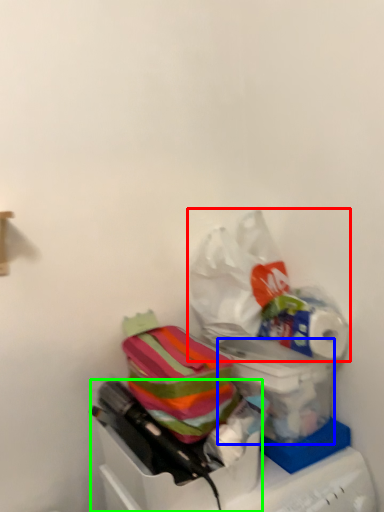
Question: Estimate the real-world distances between objects in this image. Which object is farther from plastic bag (highlighted by a red box), box (highlighted by a blue box) or box (highlighted by a green box)?

Choices:
 (A) box
 (B) box

Answer: (B)